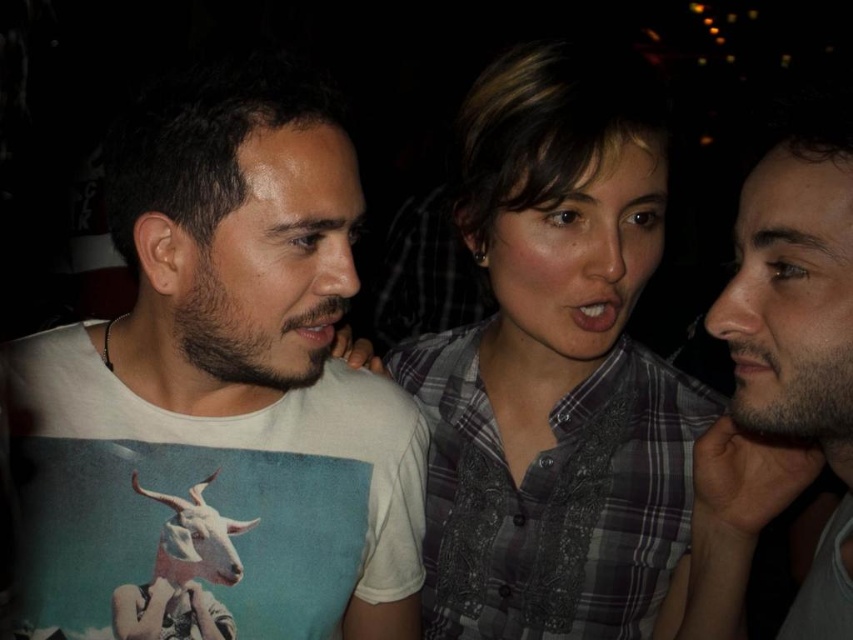
You are at a bar and see two people wearing shirts at the center. The plaid shirt at center and the beige fabric shirt at center. Which shirt is taller?

The plaid shirt at center is much taller than the beige fabric shirt at center.